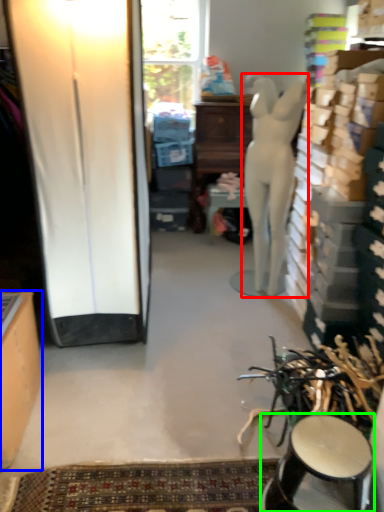
Question: Which object is the farthest from person (highlighted by a red box)? Choose among these: cabinetry (highlighted by a blue box) or stool (highlighted by a green box).

Choices:
 (A) cabinetry
 (B) stool

Answer: (A)